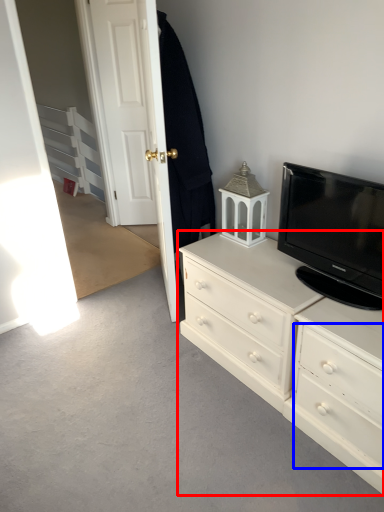
Question: Among these objects, which one is nearest to the camera, chest of drawers (highlighted by a red box) or drawer (highlighted by a blue box)?

Choices:
 (A) chest of drawers
 (B) drawer

Answer: (B)